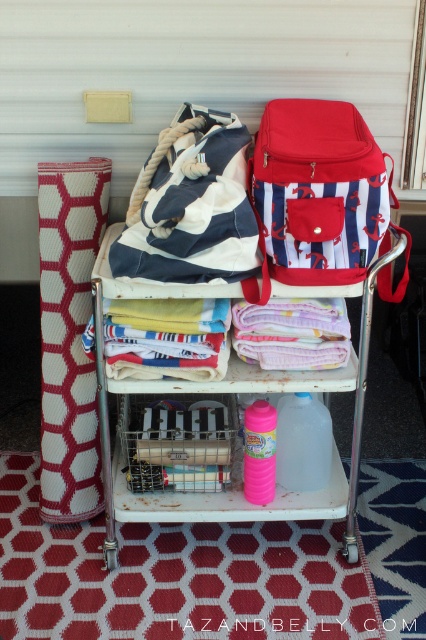
From the picture: You are standing at the point labeled point (388, 216) and want to reach the cart. The cart is 1.36 meters away. If you can walk 1 meter per second, how many seconds will it take you to reach the cart?

The distance between you and the cart is 1.36 meters. Since you walk at 1 meter per second, it will take 1.36 seconds to reach the cart.

You are standing in front of the white metal cart at center and want to place a small item from the red striped backpack at upper right into the basket on the lower shelf. Can you reach the backpack without moving the cart?

The red striped backpack at upper right is closer to the viewer than the white metal cart at center, so you can easily reach it without moving the cart.

Consider the image. You are organizing items on the white metal cart at center and need to place a new red striped backpack at upper right. Based on the current arrangement, where should you place the new backpack?

The red striped backpack at upper right should be placed on the right side of the white metal cart at center, as it is already positioned there according to the description.